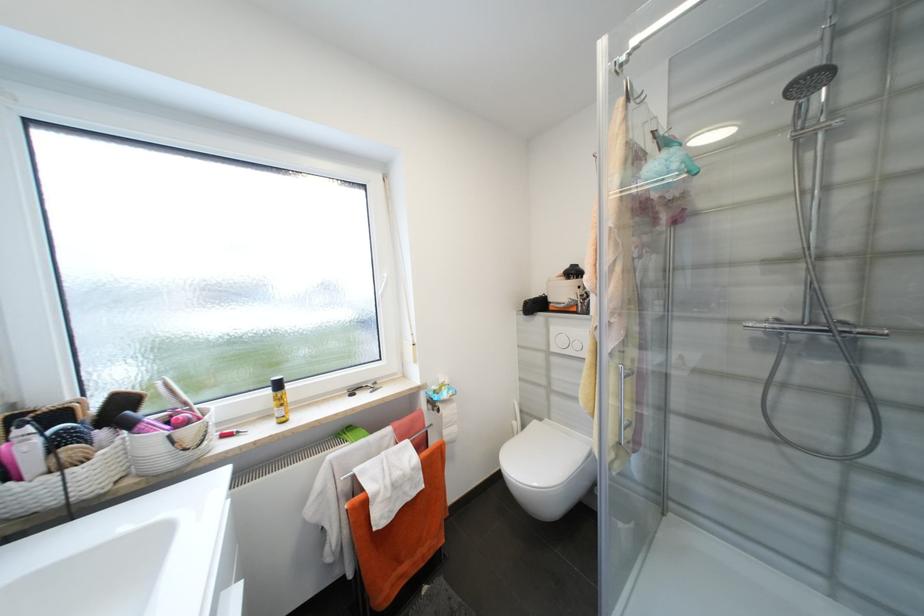
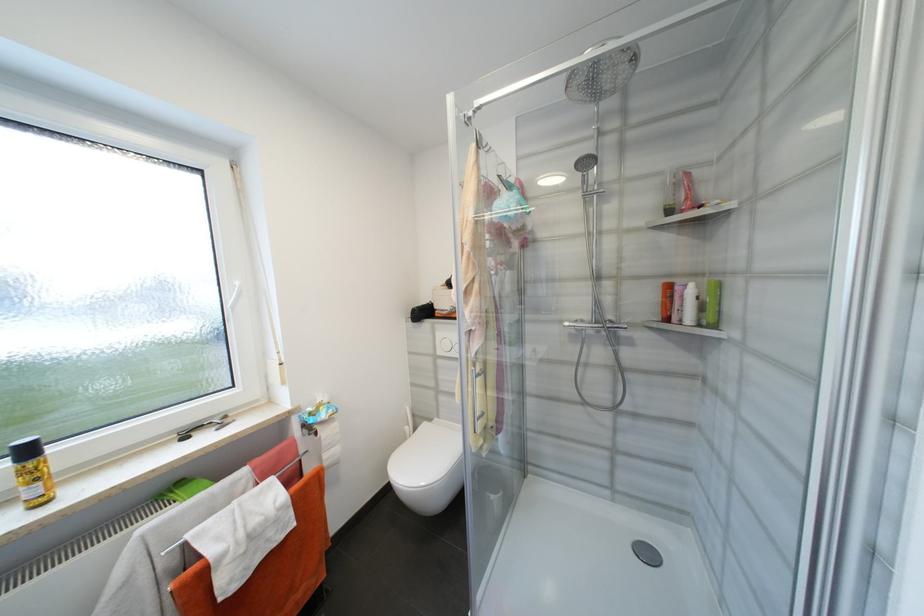
Locate, in the second image, the point that corresponds to the point at 444,411 in the first image.

(322, 435)